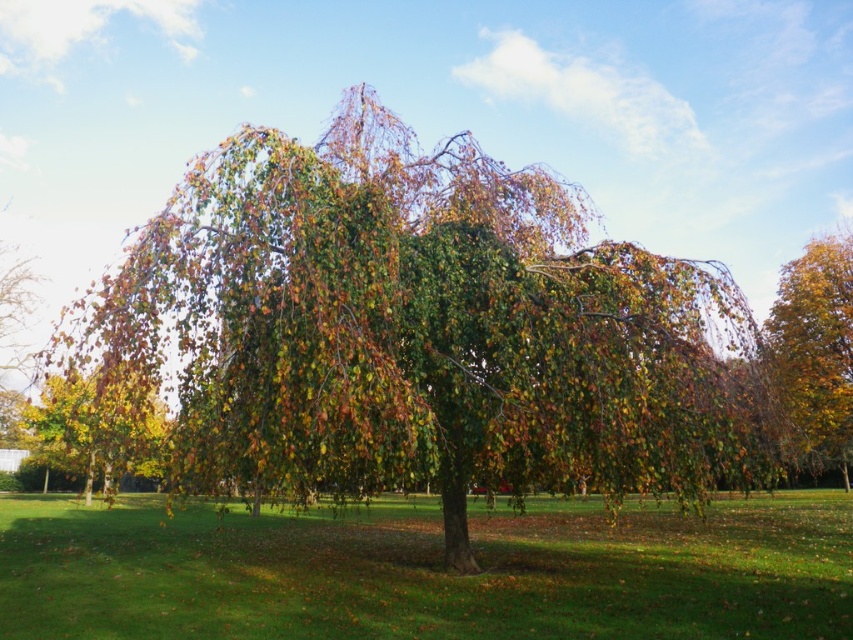
Question: Among these objects, which one is nearest to the camera?

Choices:
 (A) yellow-green leaves at right
 (B) green grass at center

Answer: (B)

Question: Estimate the real-world distances between objects in this image. Which object is closer to the green leafy tree at center?

Choices:
 (A) green grass at center
 (B) yellow-green leaves at right

Answer: (A)

Question: Is green grass at center above yellow-green leaves at right?

Choices:
 (A) no
 (B) yes

Answer: (A)

Question: Which point is farther to the camera?

Choices:
 (A) green grass at center
 (B) yellow-green leaves at lower left

Answer: (A)

Question: Can you confirm if green leafy tree at center is positioned below yellow-green leaves at lower left?

Choices:
 (A) yes
 (B) no

Answer: (B)

Question: Can you confirm if green leafy tree at center is positioned below yellow-green leaves at right?

Choices:
 (A) yes
 (B) no

Answer: (B)